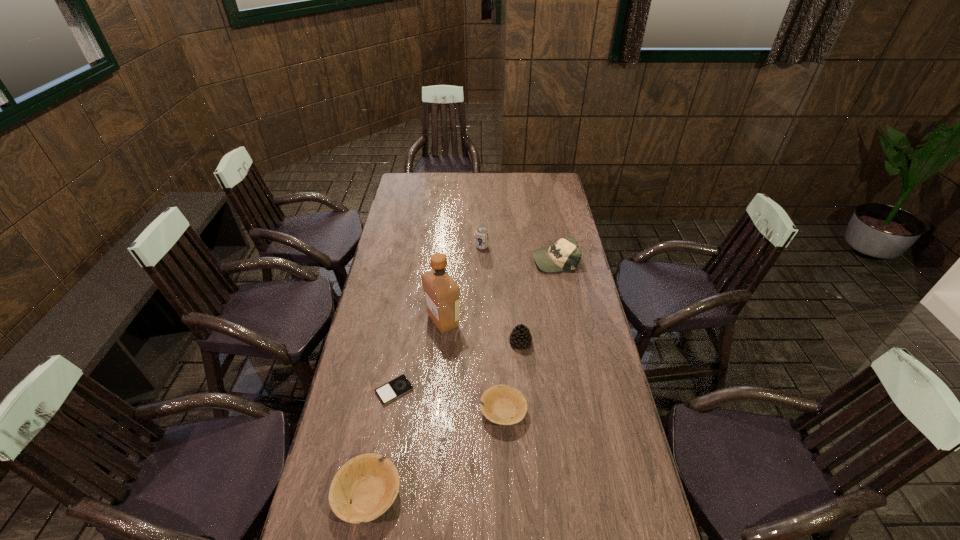
The width and height of the screenshot is (960, 540). Identify the location of the nearer bowl. (370, 482).

Identify the location of the taller bowl. (370, 482).

Locate an element on the screen. The height and width of the screenshot is (540, 960). the right bowl is located at coordinates (502, 404).

Locate an element on the screen. The width and height of the screenshot is (960, 540). the farther bowl is located at coordinates (502, 404).

You are a GUI agent. You are given a task and a screenshot of the screen. Output one action in this format:
    pyautogui.click(x=<x>, y=<y>)
    Task: Click on the beer can
    The image size is (960, 540).
    Given the screenshot: What is the action you would take?
    pyautogui.click(x=481, y=233)

Where is `the fifth object from right to left`? The image size is (960, 540). the fifth object from right to left is located at coordinates (442, 294).

The width and height of the screenshot is (960, 540). Find the location of `liquor`. liquor is located at coordinates (442, 294).

Image resolution: width=960 pixels, height=540 pixels. Find the location of `baseball cap`. baseball cap is located at coordinates (564, 255).

I want to click on iPod, so click(399, 386).

This screenshot has height=540, width=960. I want to click on pinecone, so click(x=520, y=337).